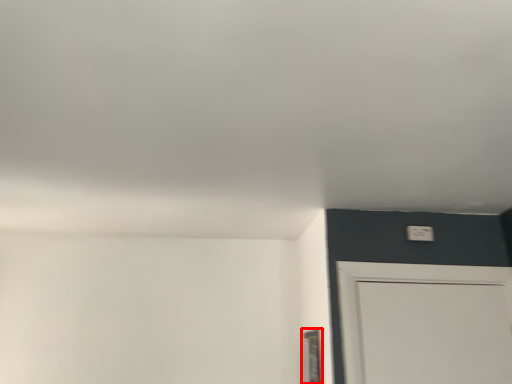
Question: From the image's perspective, considering the relative positions of window (annotated by the red box) and light switch in the image provided, where is window (annotated by the red box) located with respect to the staircase?

Choices:
 (A) above
 (B) below

Answer: (B)